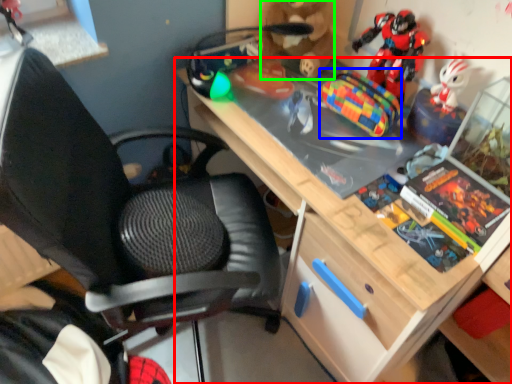
Question: Which object is the closest to the desk (highlighted by a red box)? Choose among these: toy (highlighted by a blue box) or toy (highlighted by a green box).

Choices:
 (A) toy
 (B) toy

Answer: (A)